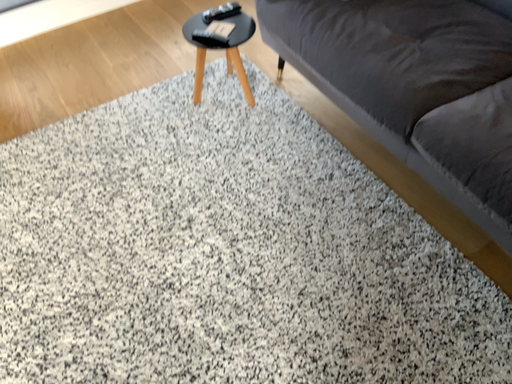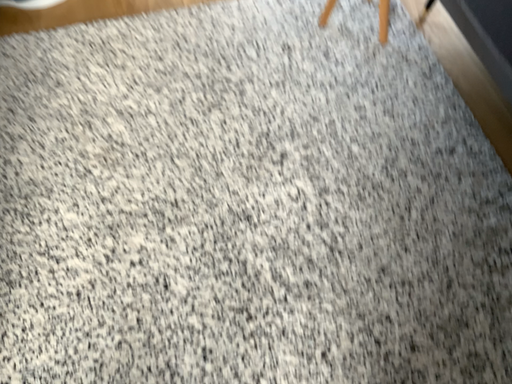
Question: Which way did the camera rotate in the video?

Choices:
 (A) rotated upward
 (B) rotated downward

Answer: (B)